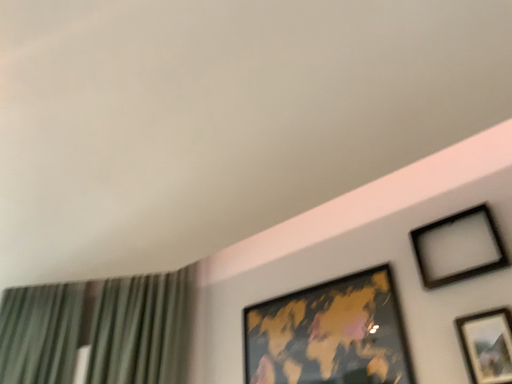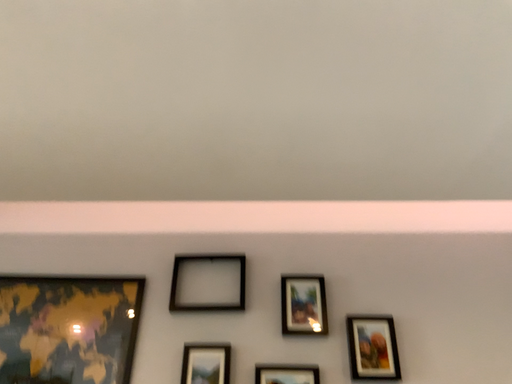
Question: Which way did the camera rotate in the video?

Choices:
 (A) rotated downward
 (B) rotated upward

Answer: (A)